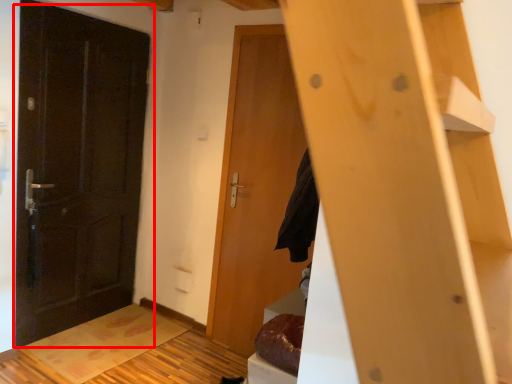
Question: From the image's perspective, considering the relative positions of door (annotated by the red box) and door in the image provided, where is door (annotated by the red box) located with respect to the staircase?

Choices:
 (A) above
 (B) below

Answer: (A)